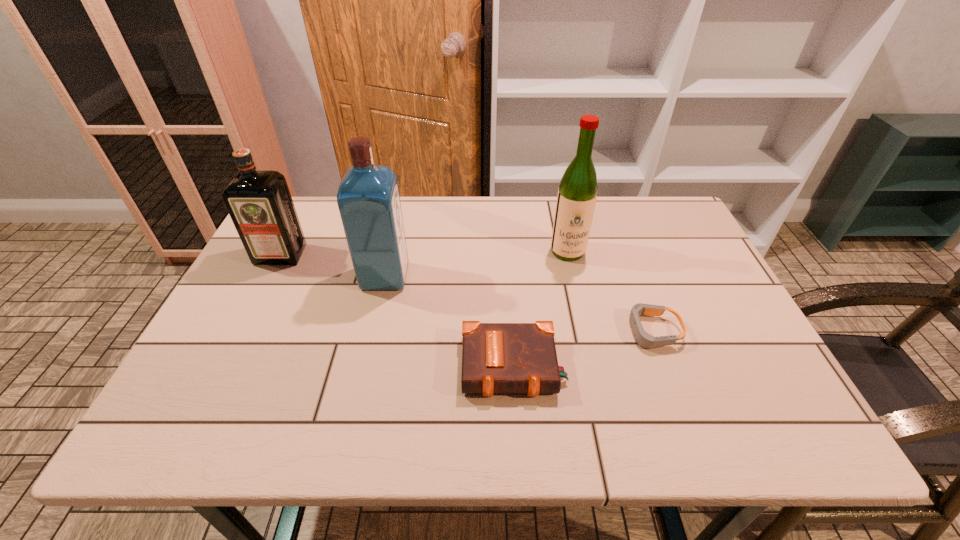
Locate an element on the screen. object that is the second closest one to the third object from right to left is located at coordinates 368,199.

Choose which object is the third nearest neighbor to the third tallest object. Please provide its 2D coordinates. Your answer should be formatted as a tuple, i.e. [(x, y)], where the tuple contains the x and y coordinates of a point satisfying the conditions above.

[(577, 193)]

Locate an element on the screen. This screenshot has height=540, width=960. liquor identified as the closest to the leftmost liquor is located at coordinates (368, 199).

Where is `liquor identified as the second closest to the leftmost object`? This screenshot has height=540, width=960. liquor identified as the second closest to the leftmost object is located at coordinates (577, 193).

Locate an element on the screen. vacant space that satisfies the following two spatial constraints: 1. on the label of the rightmost liquor; 2. on the flat label side of the second object from left to right is located at coordinates (573, 277).

I want to click on vacant space that satisfies the following two spatial constraints: 1. on the front and back of the rightmost object; 2. on the spine side of the third object from right to left, so click(x=665, y=367).

This screenshot has height=540, width=960. Identify the location of free space that satisfies the following two spatial constraints: 1. on the front and back of the shortest object; 2. on the spine side of the third object from left to right. (665, 367).

I want to click on free space that satisfies the following two spatial constraints: 1. on the label of the fourth object from left to right; 2. on the flat label side of the second liquor from right to left, so click(x=573, y=277).